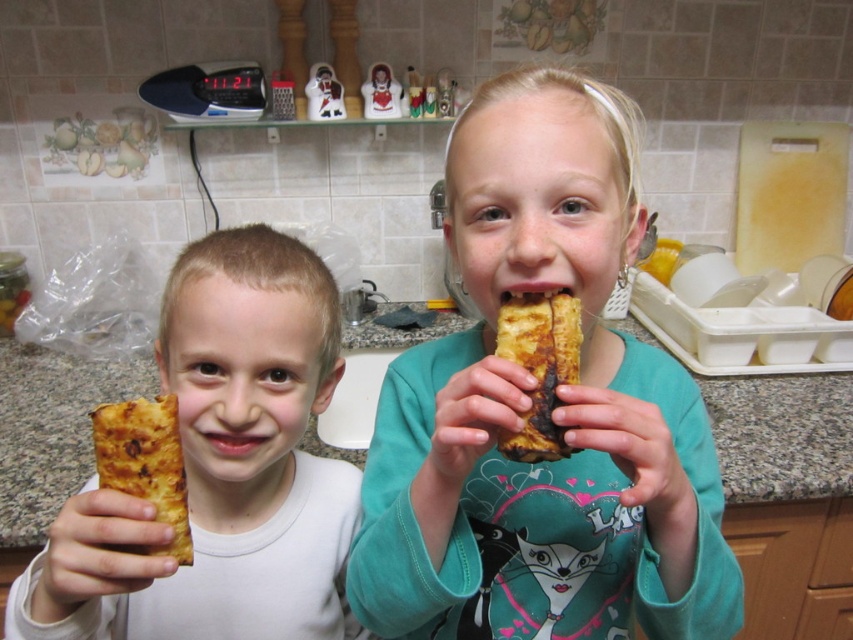
Between golden-brown flaky pastry at left and golden brown crispy bread at center, which one is positioned lower?

golden-brown flaky pastry at left

Based on the photo, does golden-brown flaky pastry at left have a lesser width compared to golden brown crispy bread at center?

In fact, golden-brown flaky pastry at left might be wider than golden brown crispy bread at center.

Find the location of a particular element. The width and height of the screenshot is (853, 640). golden-brown flaky pastry at left is located at coordinates (144, 465).

Which of these two, matte golden bread at center or granite countertop at center, stands shorter?

With less height is granite countertop at center.

Is matte golden bread at center positioned behind granite countertop at center?

No, matte golden bread at center is in front of granite countertop at center.

This screenshot has width=853, height=640. Identify the location of matte golden bread at center. (553, 412).

Between matte golden bread at center and golden brown crispy bread at center, which one is positioned lower?

matte golden bread at center is below.

Does matte golden bread at center have a greater height compared to golden brown crispy bread at center?

Correct, matte golden bread at center is much taller as golden brown crispy bread at center.

I want to click on matte golden bread at center, so click(553, 412).